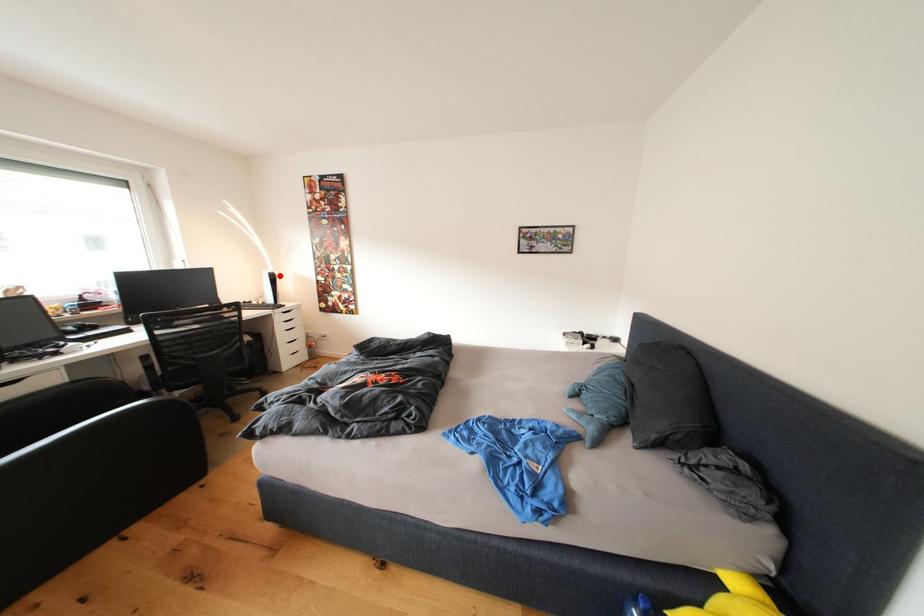
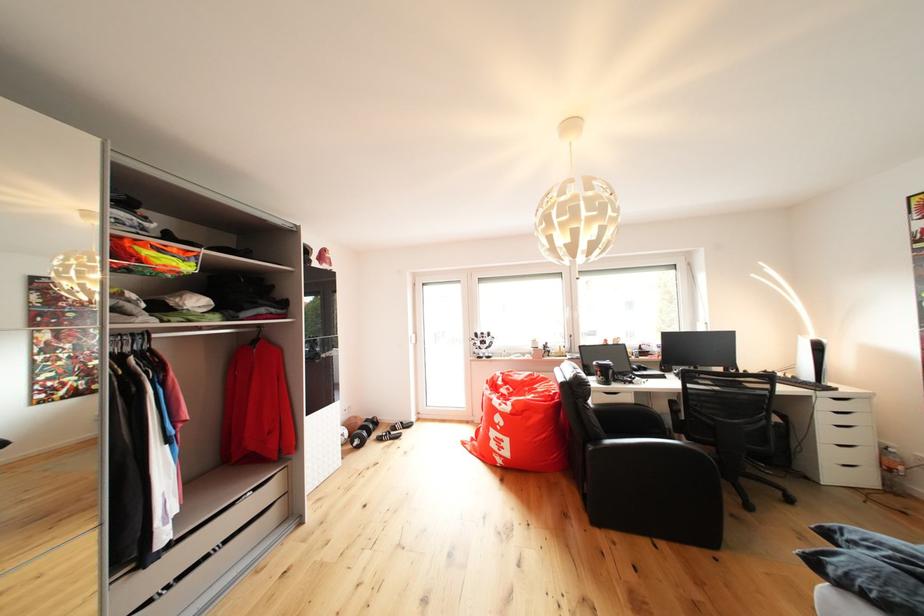
Locate, in the second image, the point that corresponds to the highlighted location in the first image.

(822, 342)